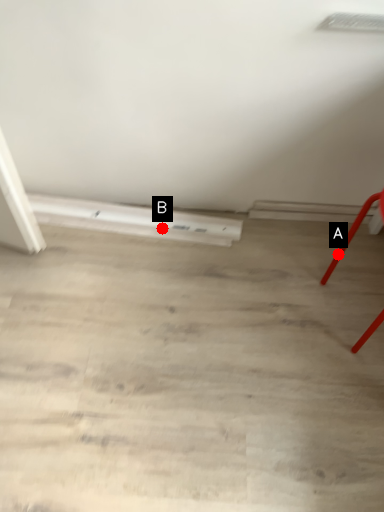
Question: Two points are circled on the image, labeled by A and B beside each circle. Which point is closer to the camera?

Choices:
 (A) A is closer
 (B) B is closer

Answer: (A)